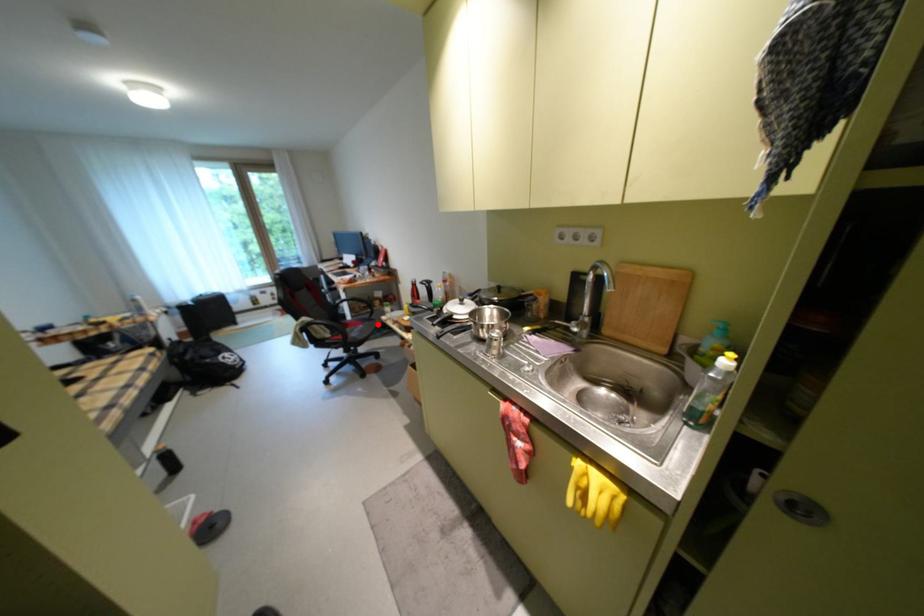
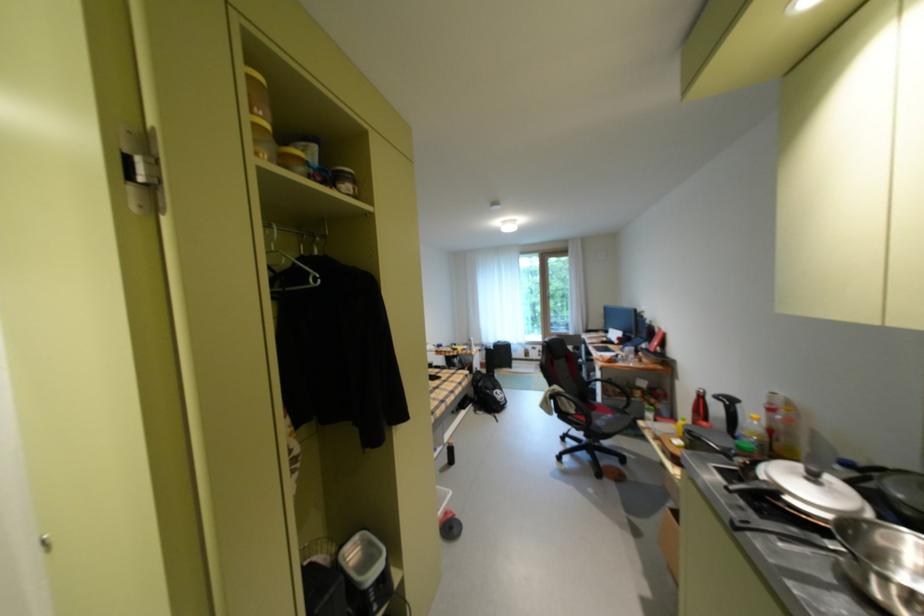
Question: I am providing you with two images of the same scene from different viewpoints. A red point is shown in image1. For the corresponding object point in image2, is it positioned nearer or farther from the camera?

Choices:
 (A) Nearer
 (B) Farther

Answer: (A)